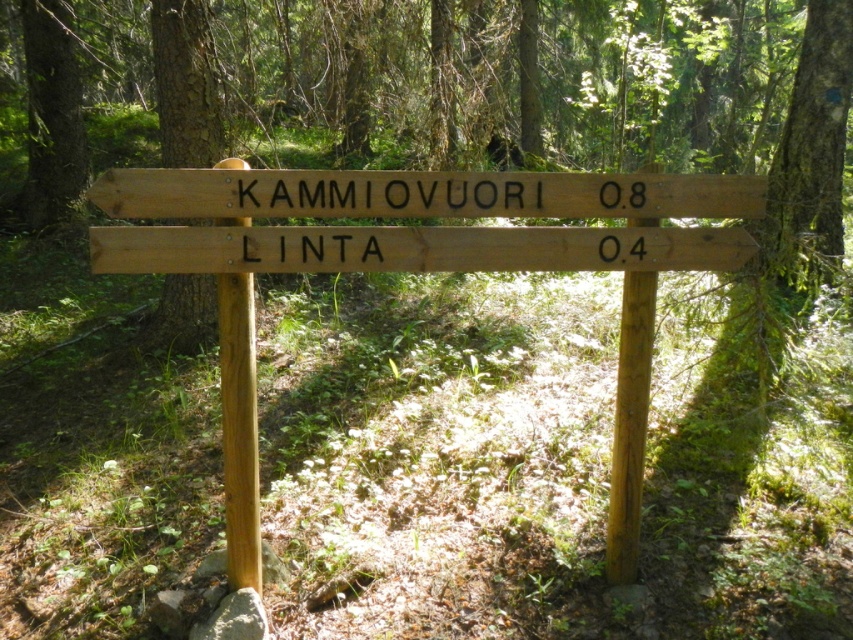
Can you confirm if wooden signpost at center is wider than brown rough bark tree at upper left?

Yes.

Between wooden signpost at center and brown rough bark tree at upper left, which one has more height?

wooden signpost at center

Does point (215, 211) come farther from viewer compared to point (196, 156)?

No.

Where is `wooden signpost at center`? wooden signpost at center is located at coordinates (419, 269).

Which is above, brown rough bark tree at upper left or brown rough tree trunk at upper left?

brown rough tree trunk at upper left is higher up.

From the picture: Which of these two, brown rough bark tree at upper left or brown rough tree trunk at upper left, stands taller?

brown rough tree trunk at upper left is taller.

At what (x,y) coordinates should I click in order to perform the action: click on brown rough bark tree at upper left. Please return your answer as a coordinate pair (x, y). Image resolution: width=853 pixels, height=640 pixels. Looking at the image, I should click on (184, 83).

At what (x,y) coordinates should I click in order to perform the action: click on brown rough bark tree at upper left. Please return your answer as a coordinate pair (x, y). This screenshot has height=640, width=853. Looking at the image, I should click on (184, 83).

Does point (456, 189) lie behind point (36, 116)?

No, it is not.

Is wooden signpost at center taller than brown rough tree trunk at upper left?

No.

Image resolution: width=853 pixels, height=640 pixels. I want to click on wooden signpost at center, so click(x=419, y=269).